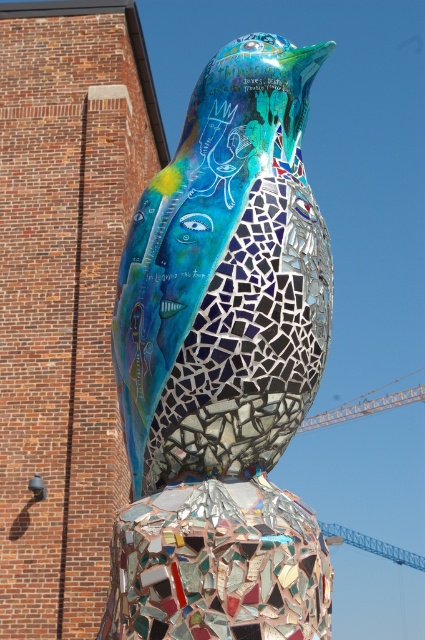
In the scene shown: You are an art curator planning to display both the mosaic bird at center and the metallic orange crane at right in a gallery. Based on their sizes, which sculpture should be placed on a higher pedestal to ensure they appear balanced in the exhibition?

The mosaic bird at center is taller than the metallic orange crane at right, so to balance their heights, the metallic orange crane at right should be placed on a higher pedestal.

You are an art curator planning to display both the mosaic bird at center and the metallic orange crane at right in a gallery. Based on their sizes, which one should be placed closer to the entrance to ensure visitors notice the larger artwork first?

The metallic orange crane at right is larger than the mosaic bird at center, so it should be placed closer to the entrance to ensure visitors notice the larger artwork first.

You are an art student observing the sculpture. You notice the mosaic bird at center and the metallic orange crane at right. Which object is positioned higher in the image?

The mosaic bird at center is located above the metallic orange crane at right, so it is positioned higher in the image.